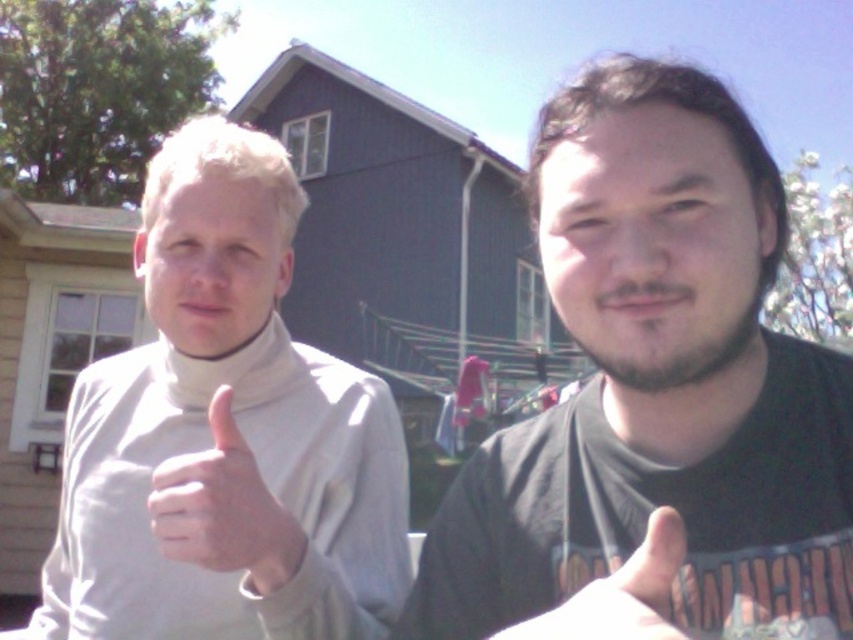
Question: Does black matte shirt at right have a smaller size compared to white matte hand at center?

Choices:
 (A) yes
 (B) no

Answer: (B)

Question: Which point is farther to the camera?

Choices:
 (A) (288, 529)
 (B) (581, 592)
 (C) (402, 476)
 (D) (769, 492)

Answer: (C)

Question: Among these objects, which one is farthest from the camera?

Choices:
 (A) black matte shirt at right
 (B) light beige fabric at left
 (C) white matte hand at center

Answer: (B)

Question: Among these objects, which one is nearest to the camera?

Choices:
 (A) light gray turtleneck sweater at left
 (B) white matte hand at center
 (C) black matte shirt at right
 (D) light beige fabric at left

Answer: (B)

Question: Is black matte shirt at right in front of light gray turtleneck sweater at left?

Choices:
 (A) yes
 (B) no

Answer: (A)

Question: Is light gray turtleneck sweater at left to the right of light beige fabric at left from the viewer's perspective?

Choices:
 (A) yes
 (B) no

Answer: (B)